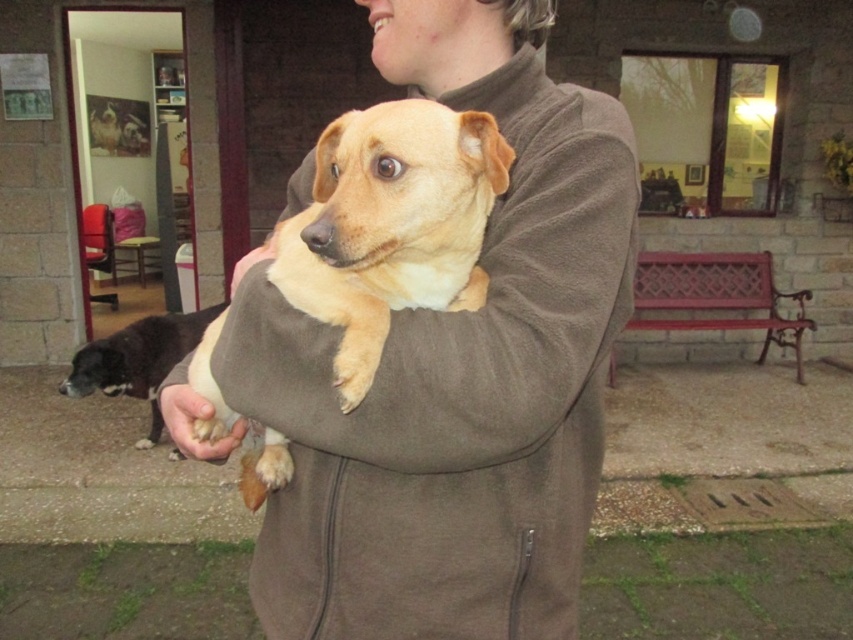
Between brown fleece jacket at center and black and white fur at lower left, which one has more height?

brown fleece jacket at center

Can you confirm if brown fleece jacket at center is shorter than black and white fur at lower left?

No.

Is point (582, 324) closer to camera compared to point (225, 305)?

Yes, it is.

Locate an element on the screen. Image resolution: width=853 pixels, height=640 pixels. brown fleece jacket at center is located at coordinates click(x=454, y=372).

Which is more to the left, light brown fur at center or fur at center?

From the viewer's perspective, fur at center appears more on the left side.

Between light brown fur at center and fur at center, which one is positioned lower?

Positioned lower is fur at center.

Which is in front, point (378, 244) or point (187, 417)?

Point (378, 244)

This screenshot has width=853, height=640. I want to click on light brown fur at center, so click(x=392, y=225).

Does point (183, 413) lie behind point (260, 256)?

Yes, point (183, 413) is farther from viewer.

Which is in front, point (173, 388) or point (248, 260)?

Point (248, 260) is in front.

Identify the location of fur at center. (192, 424).